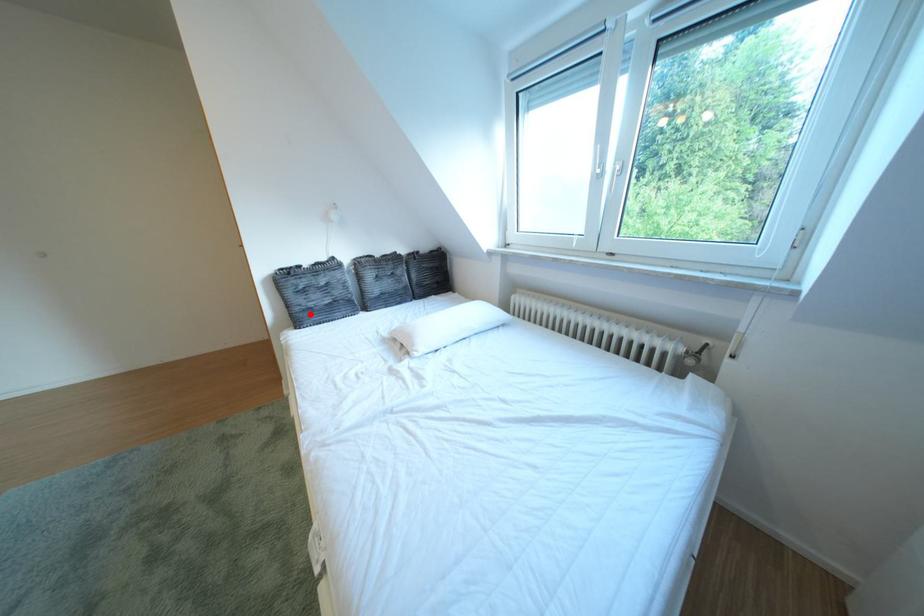
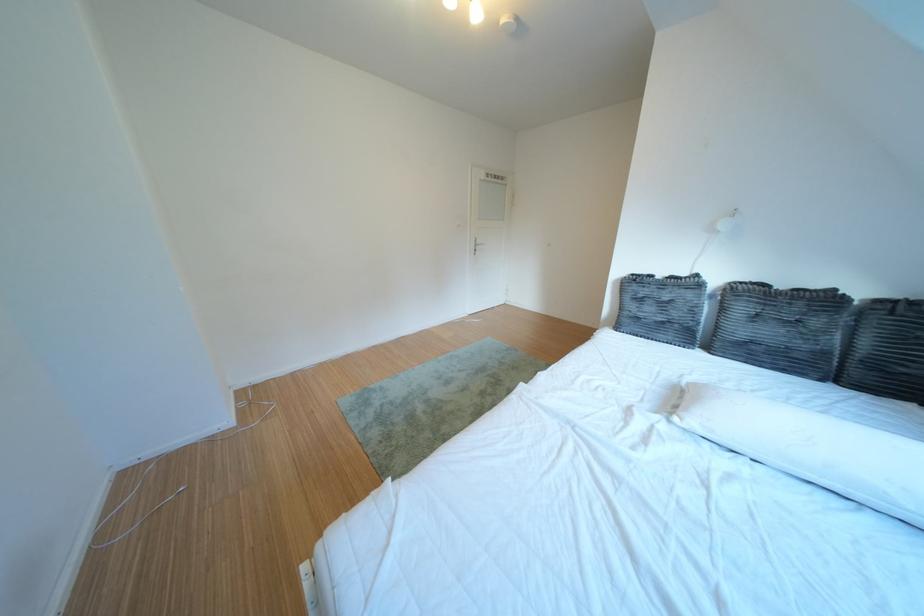
Where in the second image is the point corresponding to the highlighted location from the first image?

(639, 318)